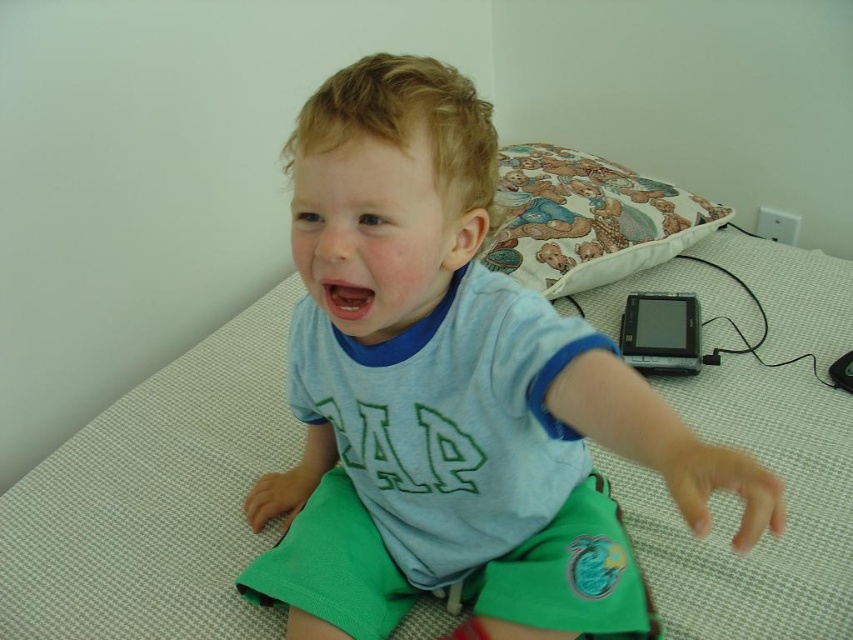
Does light blue cotton shirt at center have a larger size compared to fluffy fabric pillow at upper right?

Yes, light blue cotton shirt at center is bigger than fluffy fabric pillow at upper right.

Between point (381, 637) and point (697, 220), which one is positioned behind?

Positioned behind is point (697, 220).

Where is `light blue cotton shirt at center`? light blue cotton shirt at center is located at coordinates (451, 396).